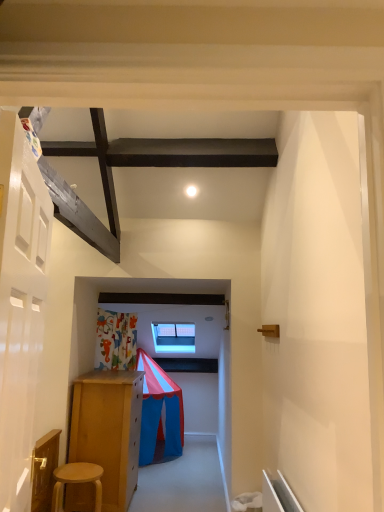
Question: Can you confirm if light brown wooden stool at lower left is bigger than white glossy door at left?

Choices:
 (A) no
 (B) yes

Answer: (A)

Question: Is light brown wooden stool at lower left aimed at white glossy door at left?

Choices:
 (A) yes
 (B) no

Answer: (B)

Question: Can you confirm if light brown wooden stool at lower left is wider than white glossy door at left?

Choices:
 (A) no
 (B) yes

Answer: (B)

Question: Does light brown wooden stool at lower left have a smaller size compared to white glossy door at left?

Choices:
 (A) no
 (B) yes

Answer: (B)

Question: Is light brown wooden stool at lower left outside of white glossy door at left?

Choices:
 (A) yes
 (B) no

Answer: (A)

Question: Considering the positions of white glossy light at upper center and light brown wooden stool at lower left in the image, is white glossy light at upper center wider or thinner than light brown wooden stool at lower left?

Choices:
 (A) wide
 (B) thin

Answer: (B)

Question: Is white glossy light at upper center to the left or to the right of light brown wooden stool at lower left in the image?

Choices:
 (A) right
 (B) left

Answer: (A)

Question: From a real-world perspective, is white glossy light at upper center above or below light brown wooden stool at lower left?

Choices:
 (A) above
 (B) below

Answer: (A)

Question: From the image's perspective, relative to light brown wooden stool at lower left, is white glossy light at upper center above or below?

Choices:
 (A) below
 (B) above

Answer: (B)

Question: From a real-world perspective, is white glossy door at left positioned above or below light brown wooden stool at lower left?

Choices:
 (A) above
 (B) below

Answer: (A)

Question: Is white glossy door at left situated inside light brown wooden stool at lower left or outside?

Choices:
 (A) outside
 (B) inside

Answer: (A)

Question: Considering the relative positions of white glossy door at left and light brown wooden stool at lower left in the image provided, is white glossy door at left to the left or to the right of light brown wooden stool at lower left?

Choices:
 (A) left
 (B) right

Answer: (B)

Question: Is white glossy door at left taller or shorter than light brown wooden stool at lower left?

Choices:
 (A) tall
 (B) short

Answer: (A)

Question: Considering the positions of white glossy light at upper center and white glossy door at left in the image, is white glossy light at upper center wider or thinner than white glossy door at left?

Choices:
 (A) wide
 (B) thin

Answer: (A)

Question: From a real-world perspective, is white glossy light at upper center above or below white glossy door at left?

Choices:
 (A) below
 (B) above

Answer: (B)